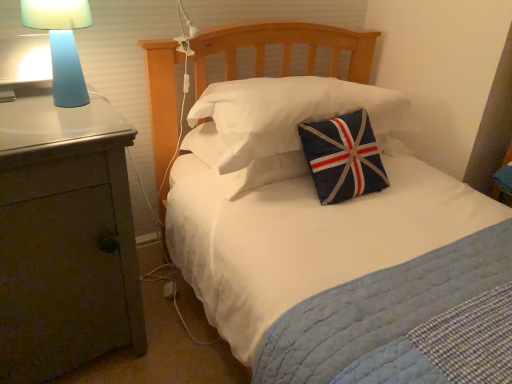
I want to click on blue matte lamp at left, so click(62, 45).

The width and height of the screenshot is (512, 384). What do you see at coordinates (287, 113) in the screenshot?
I see `navy blue fabric pillow at center, which appears as the 2th pillow when ordered from the bottom` at bounding box center [287, 113].

The image size is (512, 384). Describe the element at coordinates (265, 172) in the screenshot. I see `blue fabric pillow at center, marked as the 1th pillow in a bottom-to-top arrangement` at that location.

What do you see at coordinates (64, 238) in the screenshot? I see `matte gray nightstand at left` at bounding box center [64, 238].

At what (x,y) coordinates should I click in order to perform the action: click on blue matte lamp at left. Please return your answer as a coordinate pair (x, y). The image size is (512, 384). Looking at the image, I should click on (62, 45).

Considering the sizes of navy blue fabric pillow at center, positioned as the first pillow in top-to-bottom order, and blue matte lamp at left in the image, is navy blue fabric pillow at center, positioned as the first pillow in top-to-bottom order, taller or shorter than blue matte lamp at left?

Clearly, navy blue fabric pillow at center, positioned as the first pillow in top-to-bottom order, is shorter compared to blue matte lamp at left.

Considering the relative positions of navy blue fabric pillow at center, which appears as the 2th pillow when ordered from the bottom, and blue matte lamp at left in the image provided, is navy blue fabric pillow at center, which appears as the 2th pillow when ordered from the bottom, to the left of blue matte lamp at left from the viewer's perspective?

No.

Considering the sizes of objects navy blue fabric pillow at center, positioned as the first pillow in top-to-bottom order, and blue matte lamp at left in the image provided, who is smaller, navy blue fabric pillow at center, positioned as the first pillow in top-to-bottom order, or blue matte lamp at left?

Smaller between the two is blue matte lamp at left.

From the image's perspective, which one is positioned lower, navy blue fabric pillow at center, positioned as the first pillow in top-to-bottom order, or blue matte lamp at left?

navy blue fabric pillow at center, positioned as the first pillow in top-to-bottom order, is shown below in the image.

Is navy blue fabric pillow at center, which appears as the 2th pillow when ordered from the bottom, situated inside matte gray nightstand at left or outside?

navy blue fabric pillow at center, which appears as the 2th pillow when ordered from the bottom, lies outside matte gray nightstand at left.

Can you tell me how much navy blue fabric pillow at center, positioned as the first pillow in top-to-bottom order, and matte gray nightstand at left differ in facing direction?

1.62 degrees separate the facing orientations of navy blue fabric pillow at center, positioned as the first pillow in top-to-bottom order, and matte gray nightstand at left.

From a real-world perspective, which is physically below, navy blue fabric pillow at center, which appears as the 2th pillow when ordered from the bottom, or matte gray nightstand at left?

matte gray nightstand at left is physically lower.

Are blue matte lamp at left and navy blue fabric pillow at center, which appears as the 2th pillow when ordered from the bottom, making contact?

blue matte lamp at left is not next to navy blue fabric pillow at center, which appears as the 2th pillow when ordered from the bottom, and they're not touching.

How many degrees apart are the facing directions of blue matte lamp at left and navy blue fabric pillow at center, which appears as the 2th pillow when ordered from the bottom?

2.11 degrees.

Between blue matte lamp at left and navy blue fabric pillow at center, which appears as the 2th pillow when ordered from the bottom, which one has more height?

Standing taller between the two is blue matte lamp at left.

Relative to navy blue fabric pillow at center, positioned as the first pillow in top-to-bottom order, is blue fabric pillow at center, placed as the 2th pillow when sorted from top to bottom, in front or behind?

blue fabric pillow at center, placed as the 2th pillow when sorted from top to bottom, is behind navy blue fabric pillow at center, positioned as the first pillow in top-to-bottom order.

Based on the photo, is blue fabric pillow at center, placed as the 2th pillow when sorted from top to bottom, facing away from navy blue fabric pillow at center, which appears as the 2th pillow when ordered from the bottom?

No, blue fabric pillow at center, placed as the 2th pillow when sorted from top to bottom, is not facing away from navy blue fabric pillow at center, which appears as the 2th pillow when ordered from the bottom.

Is blue fabric pillow at center, marked as the 1th pillow in a bottom-to-top arrangement, completely or partially outside of navy blue fabric pillow at center, which appears as the 2th pillow when ordered from the bottom?

Absolutely, blue fabric pillow at center, marked as the 1th pillow in a bottom-to-top arrangement, is external to navy blue fabric pillow at center, which appears as the 2th pillow when ordered from the bottom.

Considering the sizes of objects blue fabric pillow at center, placed as the 2th pillow when sorted from top to bottom, and navy blue fabric pillow at center, which appears as the 2th pillow when ordered from the bottom, in the image provided, who is taller, blue fabric pillow at center, placed as the 2th pillow when sorted from top to bottom, or navy blue fabric pillow at center, which appears as the 2th pillow when ordered from the bottom,?

Standing taller between the two is navy blue fabric pillow at center, which appears as the 2th pillow when ordered from the bottom.

Identify the location of lamp lying on the left of blue fabric pillow at center, marked as the 1th pillow in a bottom-to-top arrangement. The width and height of the screenshot is (512, 384). (62, 45).

Looking at the image, does blue matte lamp at left seem bigger or smaller compared to blue fabric pillow at center, placed as the 2th pillow when sorted from top to bottom?

blue matte lamp at left is smaller than blue fabric pillow at center, placed as the 2th pillow when sorted from top to bottom.

From the picture: Does blue matte lamp at left contain blue fabric pillow at center, placed as the 2th pillow when sorted from top to bottom?

No, blue fabric pillow at center, placed as the 2th pillow when sorted from top to bottom, is not inside blue matte lamp at left.

Who is shorter, blue matte lamp at left or blue fabric pillow at center, marked as the 1th pillow in a bottom-to-top arrangement?

blue fabric pillow at center, marked as the 1th pillow in a bottom-to-top arrangement, is shorter.

From a real-world perspective, between matte gray nightstand at left and navy blue fabric pillow at center, positioned as the first pillow in top-to-bottom order, who is vertically lower?

matte gray nightstand at left is physically lower.

Does matte gray nightstand at left turn towards navy blue fabric pillow at center, positioned as the first pillow in top-to-bottom order?

No, matte gray nightstand at left is not oriented towards navy blue fabric pillow at center, positioned as the first pillow in top-to-bottom order.

Which is closer to the camera, (88, 133) or (324, 79)?

Clearly, point (88, 133) is closer to the camera than point (324, 79).

Does matte gray nightstand at left come behind navy blue fabric pillow at center, positioned as the first pillow in top-to-bottom order?

No, matte gray nightstand at left is closer to the camera.

Considering the sizes of objects blue matte lamp at left and matte gray nightstand at left in the image provided, who is bigger, blue matte lamp at left or matte gray nightstand at left?

matte gray nightstand at left is bigger.

Considering the points (72, 90) and (25, 248), which point is in front, point (72, 90) or point (25, 248)?

The point (25, 248) is closer to the camera.

Which object is further away from the camera taking this photo, blue matte lamp at left or matte gray nightstand at left?

blue matte lamp at left.

From the picture: Considering the relative positions of blue matte lamp at left and matte gray nightstand at left in the image provided, is blue matte lamp at left to the left or to the right of matte gray nightstand at left?

Clearly, blue matte lamp at left is on the right of matte gray nightstand at left in the image.

This screenshot has height=384, width=512. Find the location of `the 1st pillow below the blue matte lamp at left (from the image's perspective)`. the 1st pillow below the blue matte lamp at left (from the image's perspective) is located at coordinates (287, 113).

Starting from the matte gray nightstand at left, which pillow is the 1st one behind? Please provide its 2D coordinates.

[(287, 113)]

Estimate the real-world distances between objects in this image. Which object is closer to blue matte lamp at left, matte gray nightstand at left or blue fabric pillow at center, placed as the 2th pillow when sorted from top to bottom?

matte gray nightstand at left is closer to blue matte lamp at left.

When comparing their distances from matte gray nightstand at left, does navy blue fabric pillow at center, which appears as the 2th pillow when ordered from the bottom, or blue fabric pillow at center, marked as the 1th pillow in a bottom-to-top arrangement, seem further?

The object further to matte gray nightstand at left is navy blue fabric pillow at center, which appears as the 2th pillow when ordered from the bottom.

Estimate the real-world distances between objects in this image. Which object is further from matte gray nightstand at left, blue matte lamp at left or blue fabric pillow at center, marked as the 1th pillow in a bottom-to-top arrangement?

blue fabric pillow at center, marked as the 1th pillow in a bottom-to-top arrangement, is further to matte gray nightstand at left.

Based on their spatial positions, is blue fabric pillow at center, marked as the 1th pillow in a bottom-to-top arrangement, or navy blue fabric pillow at center, which appears as the 2th pillow when ordered from the bottom, further from blue matte lamp at left?

navy blue fabric pillow at center, which appears as the 2th pillow when ordered from the bottom.

Looking at this image, estimate the real-world distances between objects in this image. Which object is closer to matte gray nightstand at left, navy blue fabric pillow at center, positioned as the first pillow in top-to-bottom order, or blue matte lamp at left?

blue matte lamp at left is positioned closer to the anchor matte gray nightstand at left.

Looking at the image, which one is located further to blue fabric pillow at center, marked as the 1th pillow in a bottom-to-top arrangement, blue matte lamp at left or navy blue fabric pillow at center, positioned as the first pillow in top-to-bottom order?

blue matte lamp at left.

Based on their spatial positions, is navy blue fabric pillow at center, which appears as the 2th pillow when ordered from the bottom, or blue matte lamp at left further from blue fabric pillow at center, marked as the 1th pillow in a bottom-to-top arrangement?

Based on the image, blue matte lamp at left appears to be further to blue fabric pillow at center, marked as the 1th pillow in a bottom-to-top arrangement.

When comparing their distances from navy blue fabric pillow at center, which appears as the 2th pillow when ordered from the bottom, does matte gray nightstand at left or blue fabric pillow at center, marked as the 1th pillow in a bottom-to-top arrangement, seem closer?

blue fabric pillow at center, marked as the 1th pillow in a bottom-to-top arrangement.

Image resolution: width=512 pixels, height=384 pixels. Find the location of `lamp situated between matte gray nightstand at left and navy blue fabric pillow at center, which appears as the 2th pillow when ordered from the bottom, from left to right`. lamp situated between matte gray nightstand at left and navy blue fabric pillow at center, which appears as the 2th pillow when ordered from the bottom, from left to right is located at coordinates (62, 45).

Identify the location of pillow between blue matte lamp at left and navy blue fabric pillow at center, positioned as the first pillow in top-to-bottom order. (265, 172).

This screenshot has width=512, height=384. I want to click on pillow located between matte gray nightstand at left and navy blue fabric pillow at center, which appears as the 2th pillow when ordered from the bottom, in the left-right direction, so pyautogui.click(x=265, y=172).

What are the coordinates of `lamp located between matte gray nightstand at left and blue fabric pillow at center, marked as the 1th pillow in a bottom-to-top arrangement, in the left-right direction` in the screenshot? It's located at (62, 45).